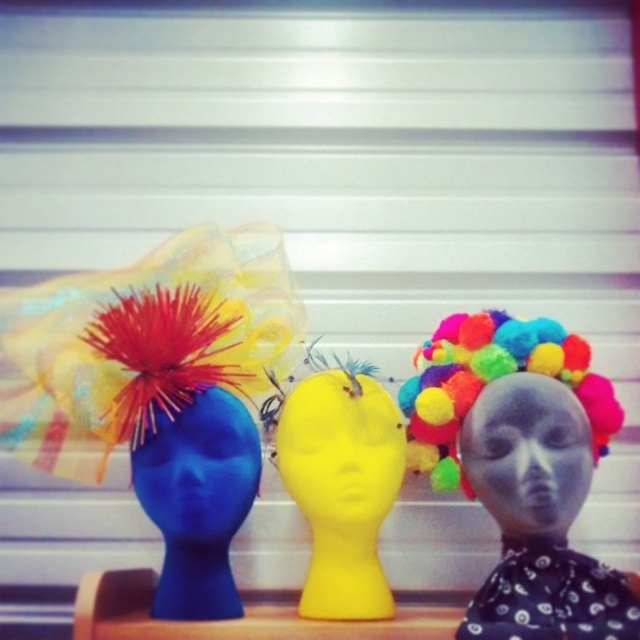
You are a fashion designer who wants to place a new accessory between the multicolored fabric wig at center and the yellow matte head at center. The accessory requires 5 inches of space. Can you fit it there?

The multicolored fabric wig at center is 4.97 inches away from the yellow matte head at center. Since the required space is 5 inches, the accessory cannot be placed between them as there is insufficient space.

You are an interior designer assessing the placement of a new lamp in the room. The lamp must be positioned so that it illuminates the multicolored fabric wig at center without casting a shadow on the blue mannequin head. Given that the lamp will be placed at point (522, 467), which object from the scene will it illuminate most effectively?

The lamp placed at point (522, 467) will illuminate the multicolored fabric wig at center most effectively because the point indicates that location.

You are an interior designer looking at the image of three mannequin heads arranged side by side with colorful hats. You notice a specific point at coordinates point (x=522, y=467). Which object from the scene does this point belong to?

The point (x=522, y=467) is located on the multicolored fabric wig at center.